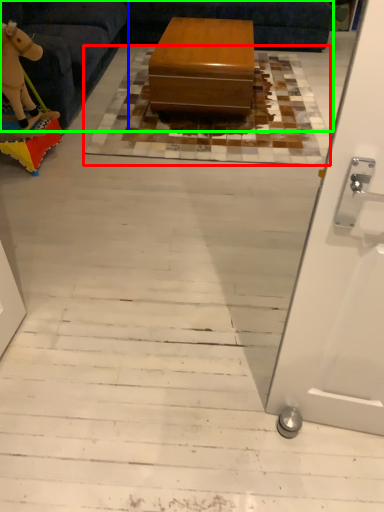
Question: Which object is the closest to the mat (highlighted by a red box)? Choose among these: furniture (highlighted by a blue box) or couch (highlighted by a green box).

Choices:
 (A) furniture
 (B) couch

Answer: (A)